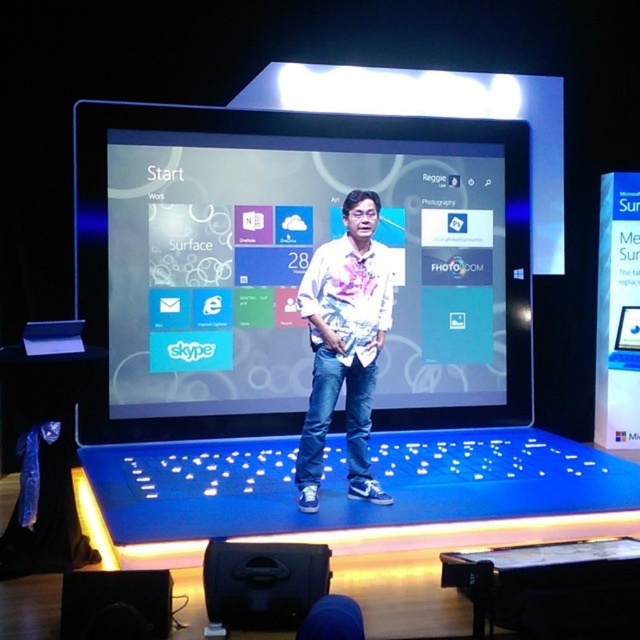
You are an audience member sitting in the front row of the presentation. You notice the matte plastic screen at center and the white printed shirt at center. Which object is located to the left when viewed from your perspective?

The matte plastic screen at center is positioned on the left side of the white printed shirt at center, so from your perspective as an audience member, the matte plastic screen at center is to the left of the white printed shirt at center.

You are an event planner setting up for a tech conference. You need to ensure that the white printed shirt at center of the presenter does not block the matte plastic screen at center during their presentation. Based on the scene, will the presenter be able to stand in front of the screen without obstructing it?

The matte plastic screen at center is much taller than the white printed shirt at center, so the presenter can stand in front of the screen without blocking it as the screen extends above the shirt.